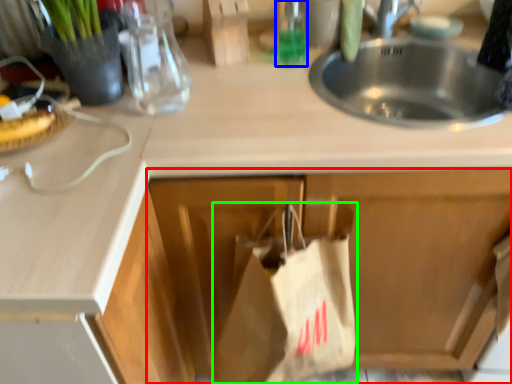
Question: Which is farther away from cabinetry (highlighted by a red box)? bottle (highlighted by a blue box) or grocery bag (highlighted by a green box)?

Choices:
 (A) bottle
 (B) grocery bag

Answer: (A)